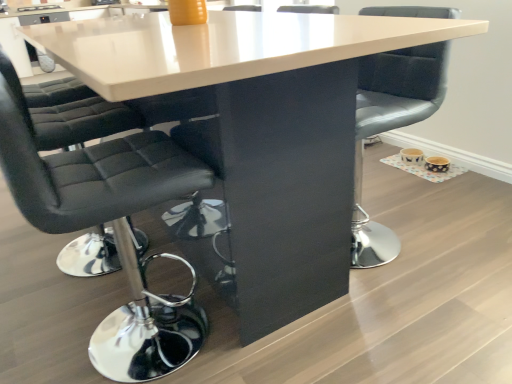
This screenshot has height=384, width=512. What are the coordinates of `free spot to the right of black leather chair at left, the first chair when ordered from left to right` in the screenshot? It's located at 264,342.